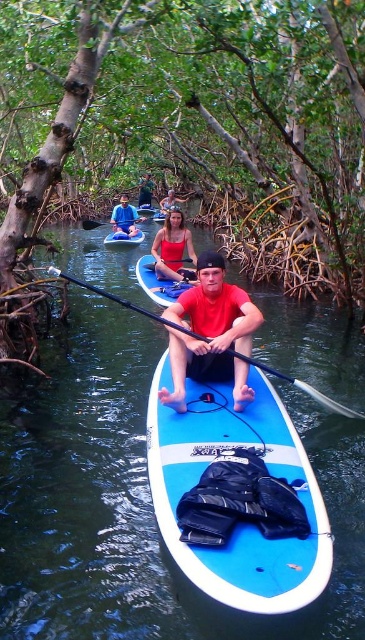
Question: Where is blue foam paddleboard at center located in relation to matte red kayak at center in the image?

Choices:
 (A) above
 (B) below

Answer: (B)

Question: Which point is closer to the camera taking this photo?

Choices:
 (A) (127, 240)
 (B) (97, 224)

Answer: (A)

Question: Considering the real-world distances, which object is farthest from the blue rubber paddle at center?

Choices:
 (A) matte red swimsuit at center
 (B) green fabric shirt at upper center
 (C) matte red kayak at center
 (D) matte red paddleboarder at center

Answer: (B)

Question: Based on their relative distances, which object is nearer to the blue rubber paddle at center?

Choices:
 (A) green fabric shirt at upper center
 (B) matte red kayak at center

Answer: (B)

Question: Does blue foam paddleboard at center appear on the right side of blue rubber paddle at upper center?

Choices:
 (A) yes
 (B) no

Answer: (A)

Question: Can you confirm if matte red swimsuit at center is thinner than green fabric shirt at upper center?

Choices:
 (A) yes
 (B) no

Answer: (B)